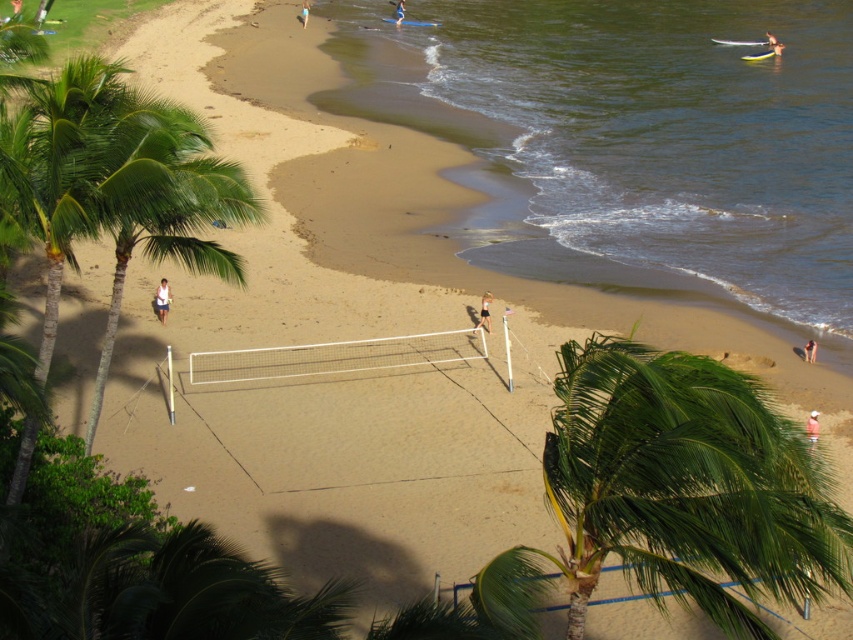
Question: Is light blue surfboard at upper right to the left of white fabric shorts at lower center from the viewer's perspective?

Choices:
 (A) yes
 (B) no

Answer: (B)

Question: Which point is farther to the camera?

Choices:
 (A) (795, 465)
 (B) (401, 19)
 (C) (300, 17)
 (D) (773, 49)

Answer: (B)

Question: Among these objects, which one is farthest from the camera?

Choices:
 (A) light blue surfboard at upper right
 (B) white cotton shirt at center
 (C) blue fabric surfboard at upper center
 (D) white fabric shorts at lower center

Answer: (C)

Question: From the image, what is the correct spatial relationship of clear water at beach center in relation to white fabric shorts at lower center?

Choices:
 (A) above
 (B) below

Answer: (B)

Question: Does white cotton shirt at center have a smaller size compared to pink fabric person at center?

Choices:
 (A) no
 (B) yes

Answer: (B)

Question: Which of the following is the farthest from the observer?

Choices:
 (A) (164, 305)
 (B) (485, 314)

Answer: (B)